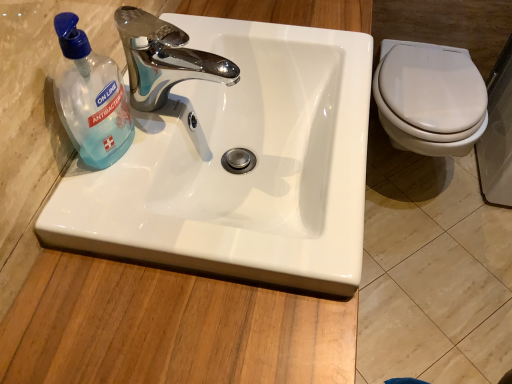
I want to click on vacant space behind chrome/metallic faucet at upper center, so click(210, 54).